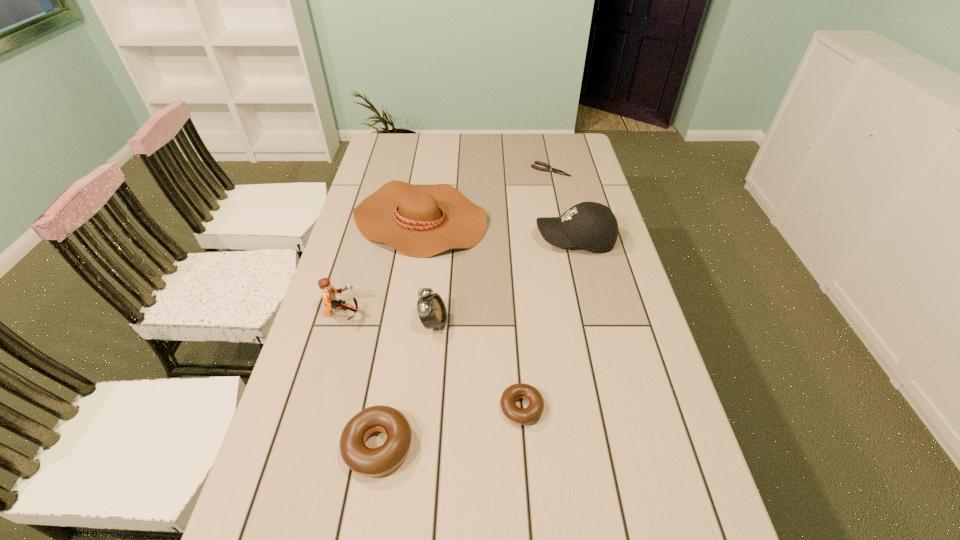
Please show where to add a doughnut on the right while keeping spacing even. Please provide its 2D coordinates. Your answer should be formatted as a tuple, i.e. [(x, y)], where the tuple contains the x and y coordinates of a point satisfying the conditions above.

[(648, 374)]